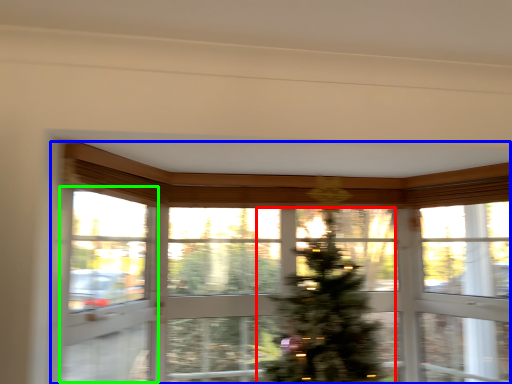
Question: Based on their relative distances, which object is nearer to christmas tree (highlighted by a red box)? Choose from window (highlighted by a blue box) and screen door (highlighted by a green box).

Choices:
 (A) window
 (B) screen door

Answer: (A)